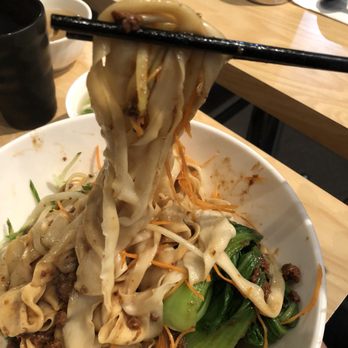
In order to click on food in bowls in this screenshot , I will do `click(58, 35)`, `click(85, 105)`, `click(69, 236)`.